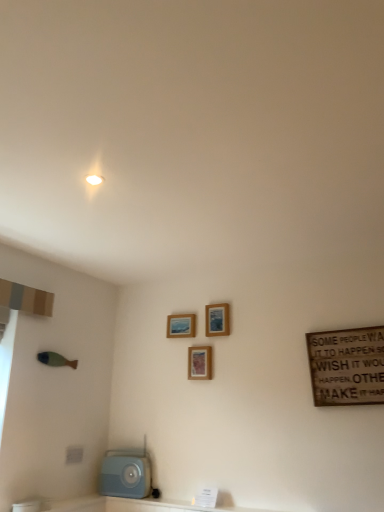
Question: From a real-world perspective, relative to wooden picture frame at upper center, the third picture frame from the right, is wooden signboard at right vertically above or below?

Choices:
 (A) above
 (B) below

Answer: (B)

Question: Considering the positions of wooden signboard at right and wooden picture frame at upper center, the third picture frame from the right, in the image, is wooden signboard at right taller or shorter than wooden picture frame at upper center, the third picture frame from the right,?

Choices:
 (A) tall
 (B) short

Answer: (A)

Question: Which object is positioned closest to the wooden picture frame at upper center, which ranks as the 1th picture frame in right-to-left order?

Choices:
 (A) light blue plastic radio at lower left
 (B) wooden picture frame at center, placed as the second picture frame when sorted from left to right
 (C) wooden signboard at right
 (D) wooden picture frame at upper center, the first picture frame viewed from the left

Answer: (D)

Question: Which object is positioned closest to the light blue plastic radio at lower left?

Choices:
 (A) wooden picture frame at center, the second picture frame viewed from the right
 (B) wooden signboard at right
 (C) wooden picture frame at upper center, the first picture frame viewed from the left
 (D) wooden picture frame at upper center, the 3th picture frame positioned from the left

Answer: (A)